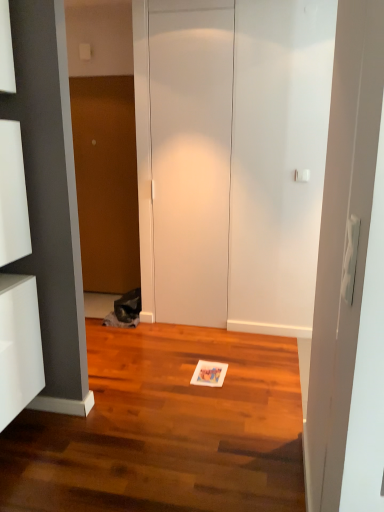
Find the location of a particular element. This screenshot has width=384, height=512. blank space situated above white matte door at center, which appears as the 2th door when viewed from the left (from a real-world perspective) is located at coordinates (191, 10).